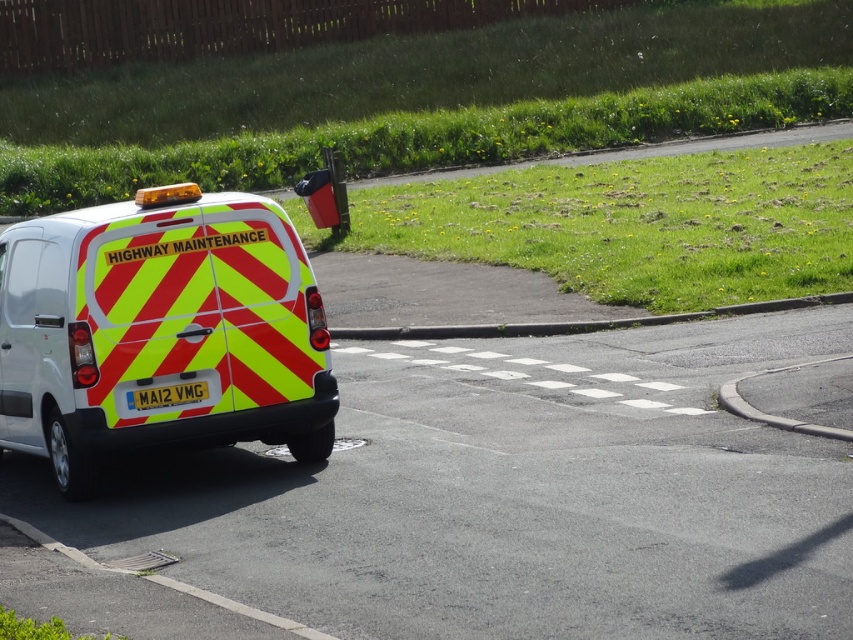
Between point (51, 438) and point (175, 394), which one is positioned in front?

Point (175, 394) is in front.

Is point (154, 230) farther from viewer compared to point (173, 397)?

Yes.

Does point (241, 420) come farther from viewer compared to point (163, 397)?

Yes, it is.

Locate an element on the screen. reflective yellow and red van at left is located at coordinates (160, 330).